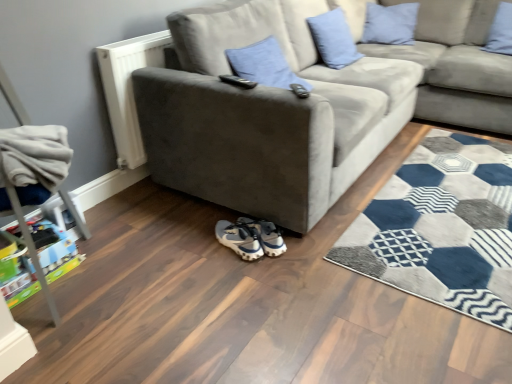
Question: Is black plastic remote control at upper center, the second remote control in the right-to-left sequence, inside or outside of light blue fabric pillow at upper center, arranged as the 3th pillow when viewed from the left?

Choices:
 (A) inside
 (B) outside

Answer: (B)

Question: From a real-world perspective, is black plastic remote control at upper center, the second remote control in the right-to-left sequence, physically located above or below light blue fabric pillow at upper center, arranged as the 3th pillow when viewed from the left?

Choices:
 (A) below
 (B) above

Answer: (B)

Question: Which of these objects is positioned farthest from the blue velvet pillow at upper right, the fourth pillow in the left-to-right sequence?

Choices:
 (A) light blue fabric pillow at upper center, positioned as the 2th pillow in right-to-left order
 (B) plastic toy car at lower left
 (C) white matte radiator at left
 (D) white fabric sneakers at lower center, the second footwear positioned from the left
 (E) suede gray couch at upper right

Answer: (B)

Question: Which is farther from the blue velvet pillow at upper right, the fourth pillow in the left-to-right sequence?

Choices:
 (A) white fabric sneakers at lower center, the second footwear positioned from the left
 (B) black plastic remote control at upper center, the second remote control in the right-to-left sequence
 (C) suede gray couch at upper right
 (D) light blue fabric pillow at upper center, arranged as the second pillow when viewed from the left
 (E) suede gray couch at center

Answer: (A)